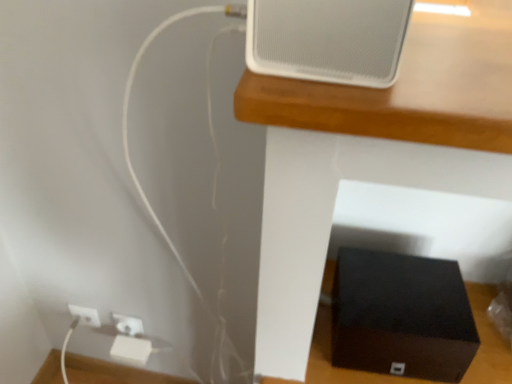
In order to face white matte speaker at upper center, should I rotate leftwards or rightwards?

To align with it, rotate right about 10.318°.

In order to face black matte box at lower right, should I rotate leftwards or rightwards?

To align with it, rotate right about 18.295°.

Locate an element on the screen. white matte speaker at upper center is located at coordinates (328, 39).

Which is behind, point (73, 327) or point (431, 378)?

The point (73, 327) is more distant.

Between white plastic electric outlet at lower left and black matte box at lower right, which one has less height?

With less height is white plastic electric outlet at lower left.

From the image's perspective, which is below, white plastic electric outlet at lower left or black matte box at lower right?

white plastic electric outlet at lower left.

Considering the relative sizes of white plastic electric outlet at lower left and black matte box at lower right in the image provided, is white plastic electric outlet at lower left smaller than black matte box at lower right?

Yes, white plastic electric outlet at lower left is smaller than black matte box at lower right.

Is point (388, 95) closer to viewer compared to point (446, 315)?

Yes.

Find the location of `furniture that appears on the right of black matte box at lower right`. furniture that appears on the right of black matte box at lower right is located at coordinates pyautogui.click(x=372, y=155).

Considering the sizes of objects black matte speaker at lower center and black matte box at lower right in the image provided, who is shorter, black matte speaker at lower center or black matte box at lower right?

Standing shorter between the two is black matte box at lower right.

This screenshot has width=512, height=384. I want to click on ipod that is above the black matte box at lower right (from a real-world perspective), so click(328, 39).

Does point (364, 328) come in front of point (315, 69)?

No, (364, 328) is further to viewer.

Is black matte box at lower right further to the viewer compared to white matte speaker at upper center?

Yes, black matte box at lower right is further from the camera.

Is black matte box at lower right with white matte speaker at upper center?

There is a gap between black matte box at lower right and white matte speaker at upper center.

Is there a large distance between black matte box at lower right and white plastic electric outlet at lower left?

black matte box at lower right is actually quite close to white plastic electric outlet at lower left.

In the image, there is a white plastic electric outlet at lower left. Where is `box above it (from the image's perspective)`? The height and width of the screenshot is (384, 512). box above it (from the image's perspective) is located at coordinates (401, 316).

Which is correct: black matte box at lower right is inside white plastic electric outlet at lower left, or outside of it?

black matte box at lower right exists outside the volume of white plastic electric outlet at lower left.

Does black matte box at lower right have a larger size compared to white plastic electric outlet at lower left?

Answer: Yes, black matte box at lower right is bigger than white plastic electric outlet at lower left.

Considering their positions, is white matte speaker at upper center located in front of or behind black matte box at lower right?

In the image, white matte speaker at upper center appears in front of black matte box at lower right.

Visually, is white matte speaker at upper center positioned to the left or to the right of black matte box at lower right?

white matte speaker at upper center is to the left of black matte box at lower right.

Is white matte speaker at upper center facing towards black matte box at lower right?

No, white matte speaker at upper center does not turn towards black matte box at lower right.

Is white plastic electric outlet at lower left shorter than black matte speaker at lower center?

Yes.

Is black matte speaker at lower center completely or partially inside white plastic electric outlet at lower left?

Actually, black matte speaker at lower center is outside white plastic electric outlet at lower left.

Could you measure the distance between white plastic electric outlet at lower left and black matte speaker at lower center?

white plastic electric outlet at lower left is 36.81 inches away from black matte speaker at lower center.

Does white plastic electric outlet at lower left have a larger size compared to black matte speaker at lower center?

No.

From the image's perspective, would you say black matte speaker at lower center is shown under white plastic electric outlet at lower left?

Actually, black matte speaker at lower center appears above white plastic electric outlet at lower left in the image.

Between black matte speaker at lower center and white plastic electric outlet at lower left, which one has larger width?

Wider between the two is black matte speaker at lower center.

From a real-world perspective, who is located higher, black matte speaker at lower center or white plastic electric outlet at lower left?

From a 3D spatial view, black matte speaker at lower center is above.

Looking at this image, in terms of height, does black matte speaker at lower center look taller or shorter compared to white plastic electric outlet at lower left?

Considering their sizes, black matte speaker at lower center has more height than white plastic electric outlet at lower left.

Where is `box on the right of white plastic electric outlet at lower left`? The width and height of the screenshot is (512, 384). box on the right of white plastic electric outlet at lower left is located at coordinates (401, 316).

Locate an element on the screen. The image size is (512, 384). box above the black matte speaker at lower center (from the image's perspective) is located at coordinates (401, 316).

Based on their spatial positions, is white plastic electric outlet at lower left or black matte box at lower right further from white matte speaker at upper center?

white plastic electric outlet at lower left lies further to white matte speaker at upper center than the other object.

From the picture: Looking at the image, which one is located further to black matte speaker at lower center, white matte speaker at upper center or white plastic electric outlet at lower left?

white plastic electric outlet at lower left is positioned further to the anchor black matte speaker at lower center.

Which object lies further to the anchor point black matte speaker at lower center, white matte speaker at upper center or black matte box at lower right?

black matte box at lower right is positioned further to the anchor black matte speaker at lower center.

Estimate the real-world distances between objects in this image. Which object is further from black matte speaker at lower center, white plastic electric outlet at lower left or black matte box at lower right?

The object further to black matte speaker at lower center is white plastic electric outlet at lower left.

From the picture: Based on their spatial positions, is black matte speaker at lower center or black matte box at lower right closer to white matte speaker at upper center?

black matte speaker at lower center.

When comparing their distances from black matte speaker at lower center, does white plastic electric outlet at lower left or white matte speaker at upper center seem closer?

The object closer to black matte speaker at lower center is white matte speaker at upper center.

Looking at the image, which one is located closer to white plastic electric outlet at lower left, black matte box at lower right or white matte speaker at upper center?

The object closer to white plastic electric outlet at lower left is black matte box at lower right.

Looking at the image, which one is located further to white matte speaker at upper center, black matte box at lower right or white plastic electric outlet at lower left?

white plastic electric outlet at lower left lies further to white matte speaker at upper center than the other object.

The height and width of the screenshot is (384, 512). Identify the location of box between white matte speaker at upper center and black matte speaker at lower center vertically. (401, 316).

In order to click on furniture between white matte speaker at upper center and white plastic electric outlet at lower left from front to back in this screenshot , I will do click(x=372, y=155).

Where is `box between white plastic electric outlet at lower left and black matte speaker at lower center`? Image resolution: width=512 pixels, height=384 pixels. box between white plastic electric outlet at lower left and black matte speaker at lower center is located at coordinates (401, 316).

Where is `box between white matte speaker at upper center and white plastic electric outlet at lower left in the front-back direction`? This screenshot has height=384, width=512. box between white matte speaker at upper center and white plastic electric outlet at lower left in the front-back direction is located at coordinates (401, 316).